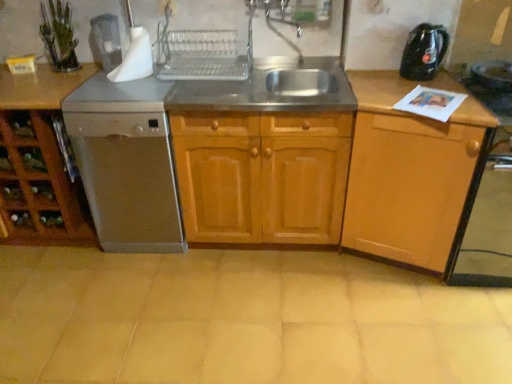
Question: From the image's perspective, relative to wooden cabinet at center, placed as the 2th cabinetry when sorted from left to right, is stainless steel sink at center above or below?

Choices:
 (A) below
 (B) above

Answer: (B)

Question: Is stainless steel sink at center taller or shorter than wooden cabinet at center, placed as the 2th cabinetry when sorted from left to right?

Choices:
 (A) short
 (B) tall

Answer: (A)

Question: Considering the real-world distances, which object is farthest from the satin silver dishwasher at left?

Choices:
 (A) black plastic kettle at upper right
 (B) beige ceramic tile at center
 (C) satin white coffee machine at upper left
 (D) brown wood cabinet at left, the 3th cabinetry viewed from the right
 (E) stainless steel sink at center

Answer: (A)

Question: Which is nearer to the wooden cabinet at center, placed as the 2th cabinetry when sorted from left to right?

Choices:
 (A) satin white coffee machine at upper left
 (B) beige ceramic tile at center
 (C) satin silver dishwasher at left
 (D) metallic silver faucet at upper center
 (E) stainless steel sink at center

Answer: (E)